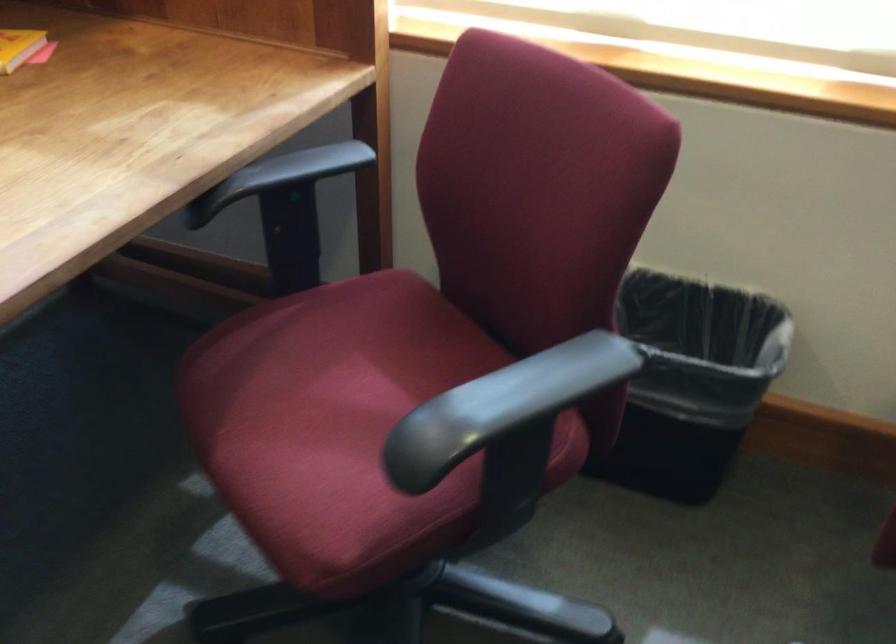
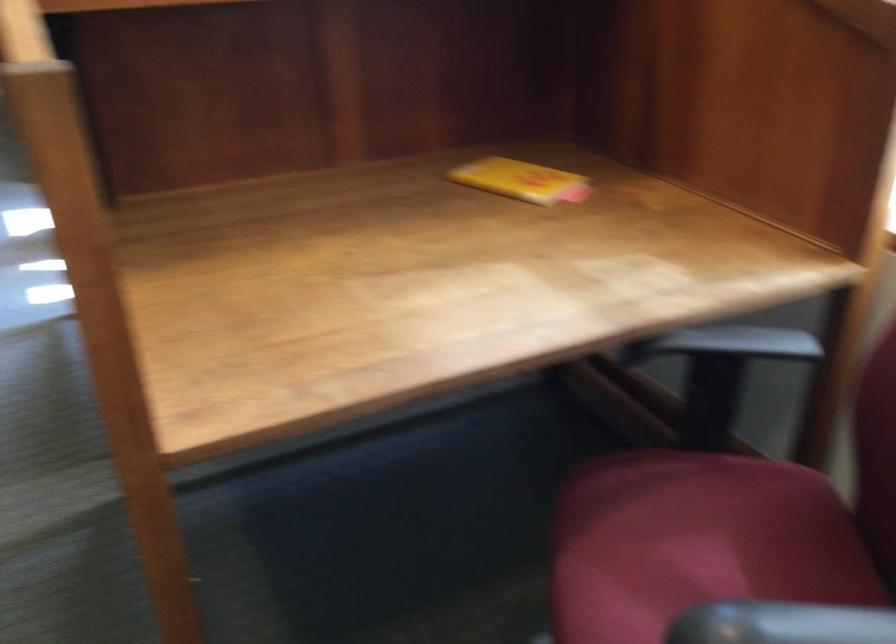
Locate, in the second image, the point that corresponds to [481,408] in the first image.

(780, 623)